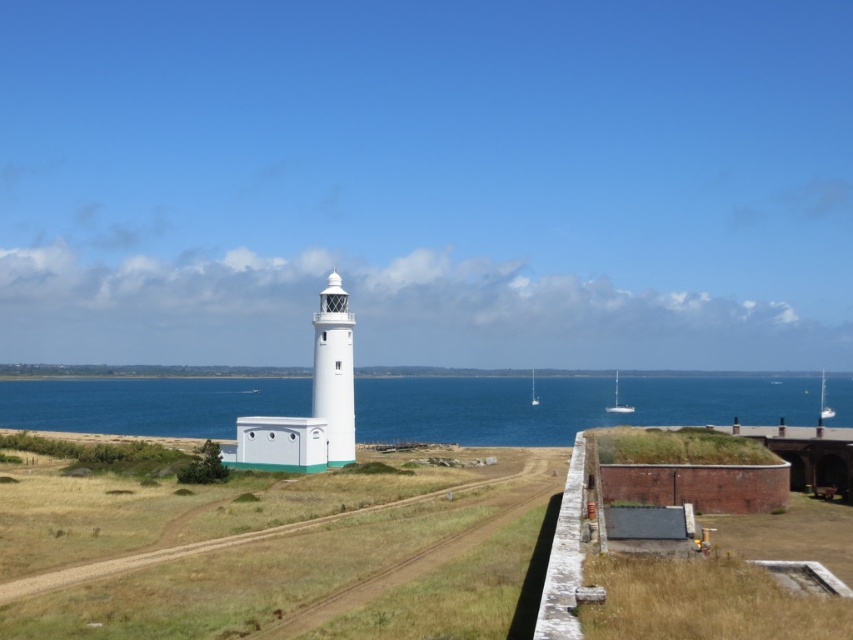
Question: Is white glossy sailboat at right closer to camera compared to white glossy sailboat at upper right?

Choices:
 (A) yes
 (B) no

Answer: (B)

Question: Does white smooth lighthouse at center come behind white glossy sailboat at center?

Choices:
 (A) yes
 (B) no

Answer: (B)

Question: Which object is farther from the camera taking this photo?

Choices:
 (A) white glossy sailboat at right
 (B) white smooth lighthouse at center
 (C) white glossy sailboat at center
 (D) blue water at center

Answer: (C)

Question: Does white glossy sailboat at right come in front of white glossy sailboat at center?

Choices:
 (A) yes
 (B) no

Answer: (A)

Question: Which is nearer to the dry grass at center?

Choices:
 (A) white smooth lighthouse at center
 (B) white glossy sailboat at upper right

Answer: (A)

Question: Which point appears closest to the camera in this image?

Choices:
 (A) (819, 416)
 (B) (531, 376)
 (C) (317, 410)
 (D) (325, 628)

Answer: (D)